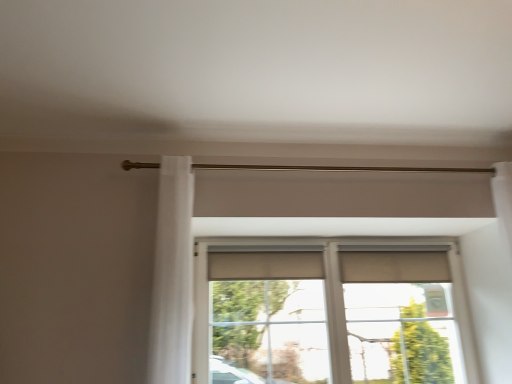
Question: Would you say matte beige window at center is inside or outside white sheer curtain at left?

Choices:
 (A) outside
 (B) inside

Answer: (A)

Question: Is point (471, 372) closer or farther from the camera than point (177, 350)?

Choices:
 (A) farther
 (B) closer

Answer: (A)

Question: Considering the relative positions of matte beige window at center and white sheer curtain at left in the image provided, is matte beige window at center to the left or to the right of white sheer curtain at left?

Choices:
 (A) left
 (B) right

Answer: (B)

Question: Is white sheer curtain at left wider or thinner than matte beige window at center?

Choices:
 (A) thin
 (B) wide

Answer: (B)

Question: Considering their positions, is white sheer curtain at left located in front of or behind matte beige window at center?

Choices:
 (A) front
 (B) behind

Answer: (A)

Question: Looking at the image, does white sheer curtain at left seem bigger or smaller compared to matte beige window at center?

Choices:
 (A) small
 (B) big

Answer: (A)

Question: Choose the correct answer: Is white sheer curtain at left inside matte beige window at center or outside it?

Choices:
 (A) inside
 (B) outside

Answer: (B)